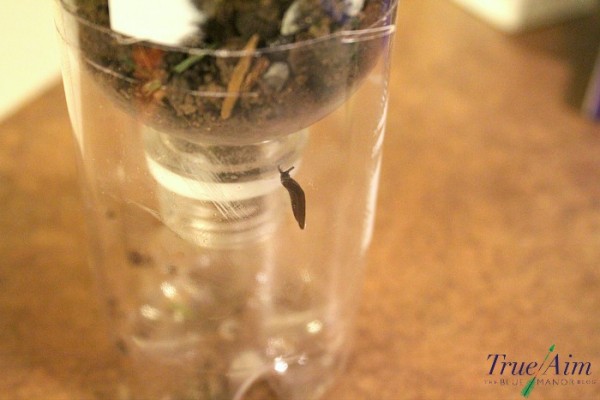
Locate an element on the screen. Image resolution: width=600 pixels, height=400 pixels. grab plastic cup here to pick up is located at coordinates (381, 170), (76, 167).